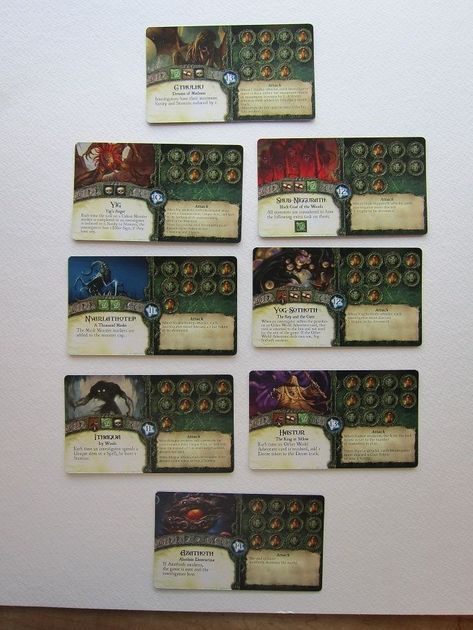
Identify the location of game cards. Image resolution: width=473 pixels, height=630 pixels. (213, 94), (173, 197), (139, 300), (148, 401), (201, 515), (298, 425), (311, 305), (290, 207).